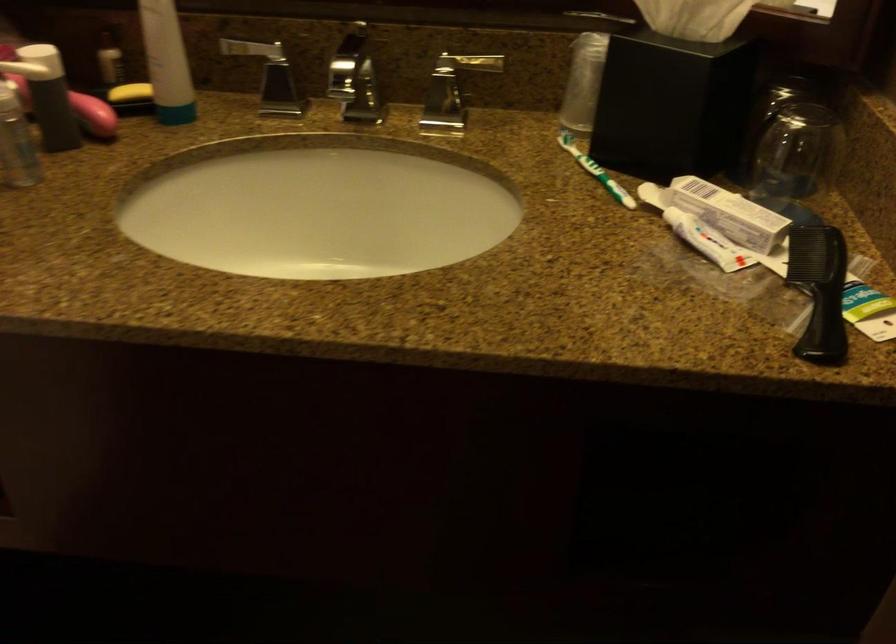
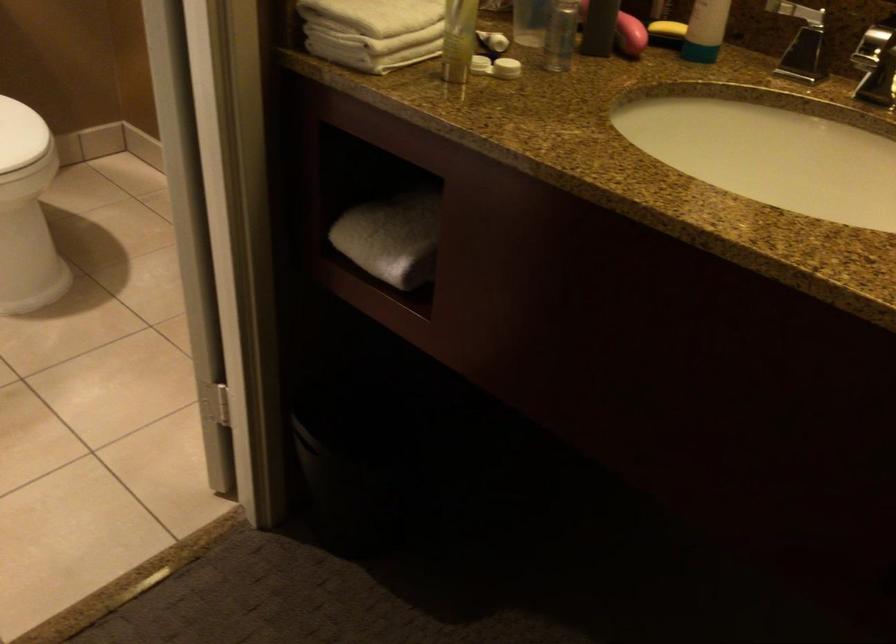
Find the pixel in the second image that matches (x=95, y=118) in the first image.

(630, 35)